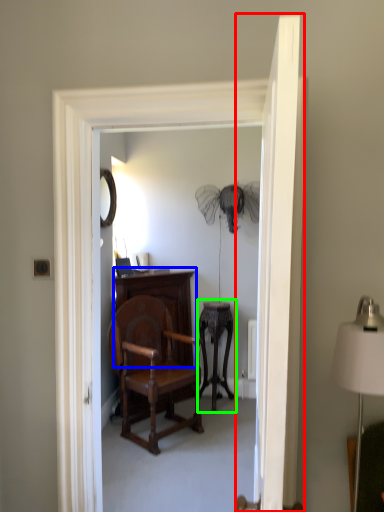
Question: Estimate the real-world distances between objects in this image. Which object is closer to door (highlighted by a red box), vanity (highlighted by a blue box) or side table (highlighted by a green box)?

Choices:
 (A) vanity
 (B) side table

Answer: (A)